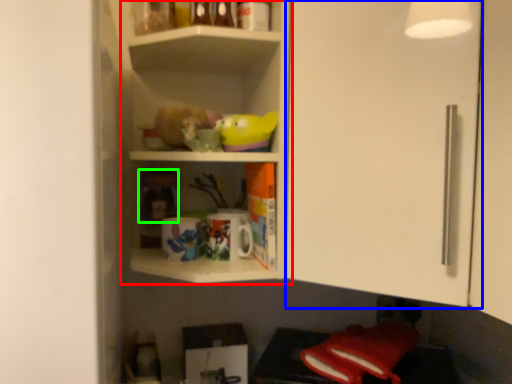
Question: Considering the real-world distances, which object is closest to shelf (highlighted by a red box)? glass door (highlighted by a blue box) or toy (highlighted by a green box).

Choices:
 (A) glass door
 (B) toy

Answer: (A)